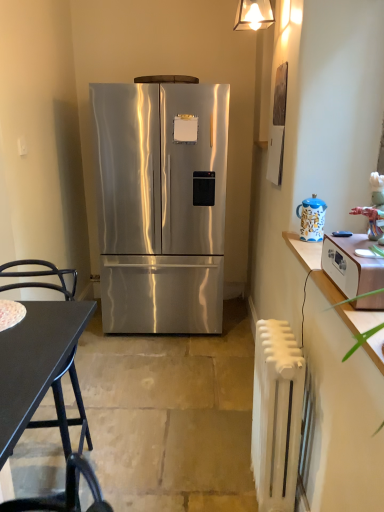
Identify the location of free space to the back side of white painted metal radiator at right. This screenshot has height=512, width=384. (229, 450).